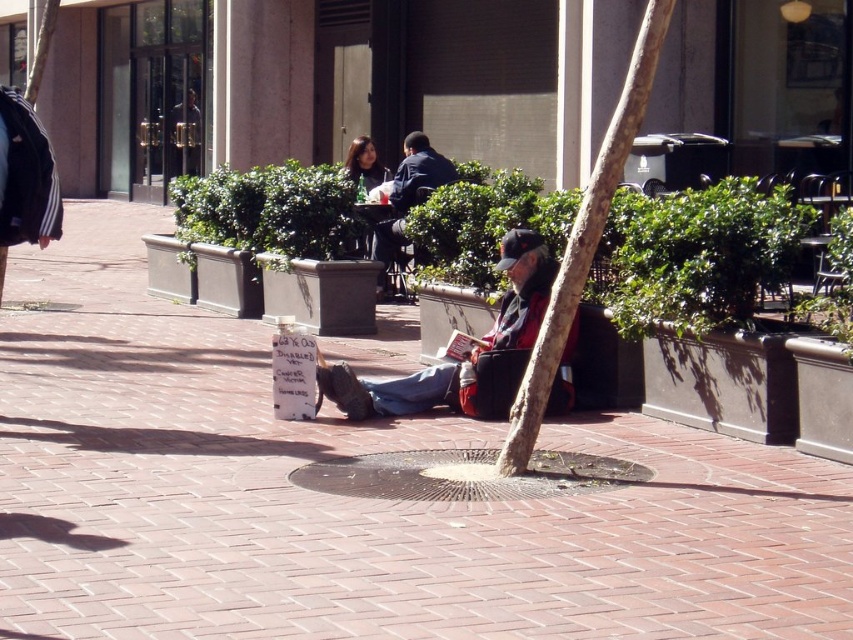
Question: Among these points, which one is nearest to the camera?

Choices:
 (A) (641, 104)
 (B) (448, 381)

Answer: (A)

Question: Is metallic gray manhole cover at center bigger than red plaid shirt at center?

Choices:
 (A) no
 (B) yes

Answer: (A)

Question: Is green leafy tree at center smaller than metallic gray manhole cover at center?

Choices:
 (A) yes
 (B) no

Answer: (B)

Question: Based on their relative distances, which object is nearer to the red plaid shirt at center?

Choices:
 (A) brick pavement at center
 (B) green leafy tree at center
 (C) dark blue jacket at center

Answer: (A)

Question: Which object is closer to the camera taking this photo?

Choices:
 (A) red plaid shirt at center
 (B) green leafy tree at center
 (C) brick pavement at center
 (D) metallic gray manhole cover at center

Answer: (C)

Question: From the image, what is the correct spatial relationship of green leafy tree at center in relation to red plaid shirt at center?

Choices:
 (A) right
 (B) left

Answer: (A)